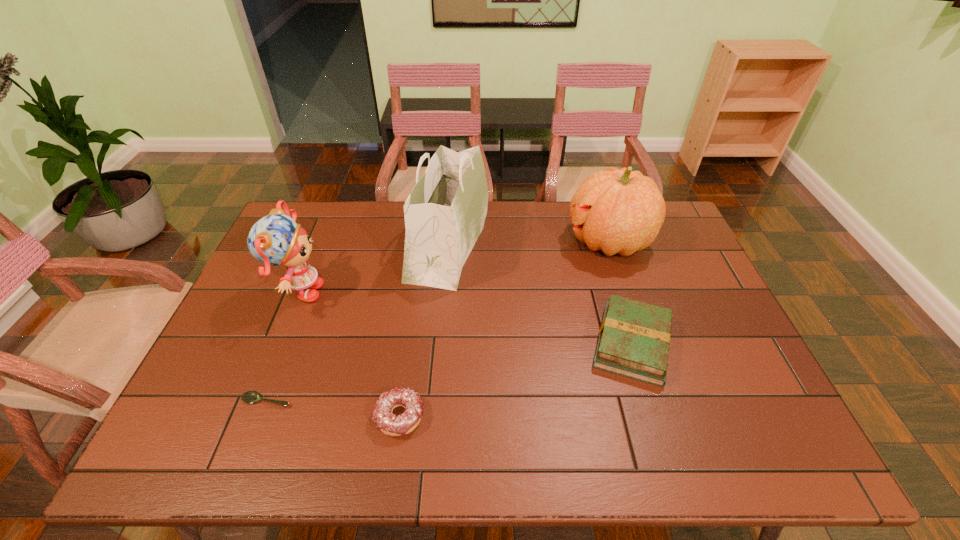
This screenshot has width=960, height=540. In order to click on blank space located on the face of the doll in this screenshot , I will do `click(433, 293)`.

Where is `vacant space situated on the right of the book`? vacant space situated on the right of the book is located at coordinates (711, 344).

Find the location of `free space located on the right of the doughnut`. free space located on the right of the doughnut is located at coordinates (571, 416).

You are a GUI agent. You are given a task and a screenshot of the screen. Output one action in this format:
    pyautogui.click(x=<x>, y=<y>)
    Task: Click on the blank area located on the back of the shortest object
    Image resolution: width=960 pixels, height=540 pixels.
    Given the screenshot: What is the action you would take?
    pyautogui.click(x=276, y=375)

Where is `grocery bag that is at the far edge`? Image resolution: width=960 pixels, height=540 pixels. grocery bag that is at the far edge is located at coordinates (445, 212).

The image size is (960, 540). Find the location of `pumpkin positioned at the far edge`. pumpkin positioned at the far edge is located at coordinates (621, 211).

Image resolution: width=960 pixels, height=540 pixels. I want to click on object that is at the near edge, so click(x=390, y=424).

Locate an element on the screen. This screenshot has width=960, height=540. doll situated at the left edge is located at coordinates (276, 239).

Find the location of `soupspoon at the left edge`. soupspoon at the left edge is located at coordinates (251, 396).

Find the location of a particular element. The image size is (960, 540). object that is at the right edge is located at coordinates (621, 211).